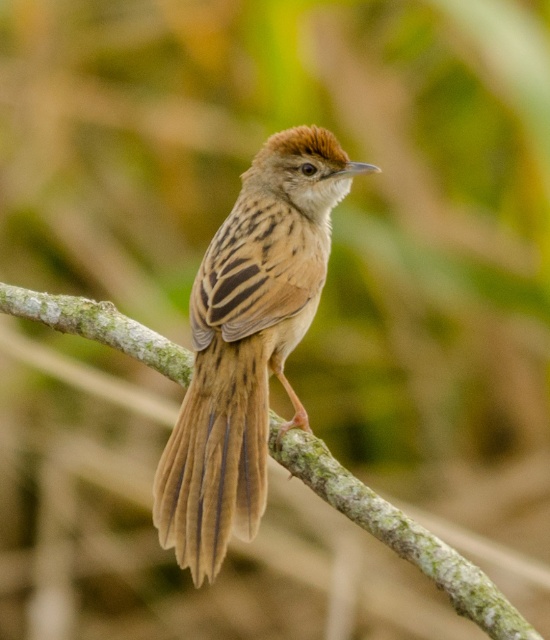
You are a nature photographer trying to capture the brown feathered sparrow at center and the green mossy branch at center in a single frame. Based on their sizes, which one should you focus on to ensure both are clearly visible in your photo?

The brown feathered sparrow at center is much taller than the green mossy branch at center, so you should focus on the brown feathered sparrow at center to ensure both are clearly visible in your photo.

You are a photographer aiming to capture the brown feathered sparrow at center in the center of your photo. Given the sparrow is located at point 0.536, 0.451, what adjustments should you make to your camera to ensure the sparrow is perfectly centered?

The brown feathered sparrow at center is already positioned at coordinates (248, 342), which is very close to the center of the image. To ensure it is perfectly centered, slightly adjust the camera to move it towards the lower right direction to align it with the exact center point.